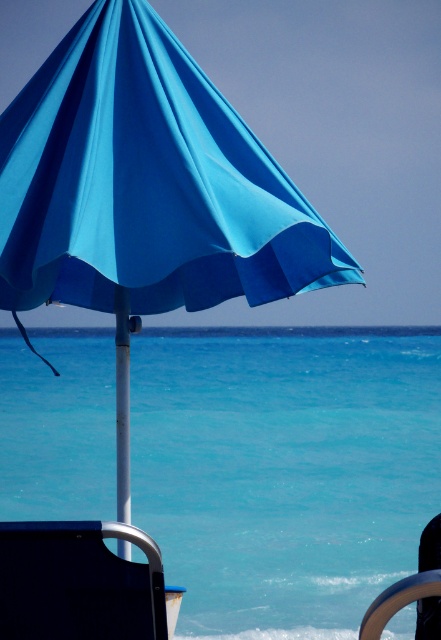
Between point (402, 611) and point (414, 579), which one is positioned in front?

Point (414, 579) is in front.

Between turquoise water at center and metallic silver ring at lower right, which one appears on the right side from the viewer's perspective?

metallic silver ring at lower right is more to the right.

Locate an element on the screen. turquoise water at center is located at coordinates (284, 474).

I want to click on blue fabric umbrella at upper center, so point(145,193).

Does point (52, 179) come closer to viewer compared to point (422, 586)?

No, (52, 179) is behind (422, 586).

Locate an element on the screen. blue fabric umbrella at upper center is located at coordinates (145, 193).

Can you confirm if turquoise water at center is smaller than blue fabric umbrella at upper center?

No, turquoise water at center is not smaller than blue fabric umbrella at upper center.

Can you confirm if turquoise water at center is positioned below blue fabric umbrella at upper center?

Yes.

At what (x,y) coordinates should I click in order to perform the action: click on turquoise water at center. Please return your answer as a coordinate pair (x, y). Looking at the image, I should click on 284,474.